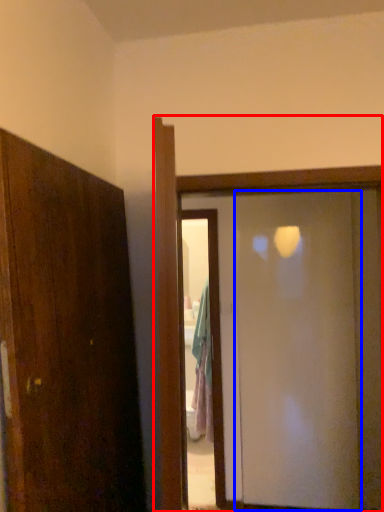
Question: Which of the following is the farthest to the observer, door (highlighted by a red box) or screen door (highlighted by a blue box)?

Choices:
 (A) door
 (B) screen door

Answer: (B)